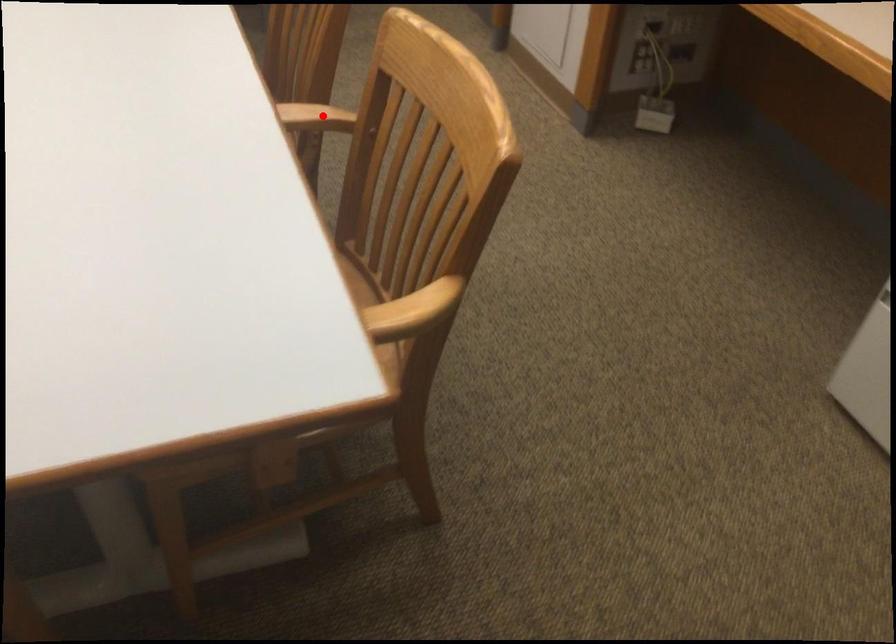
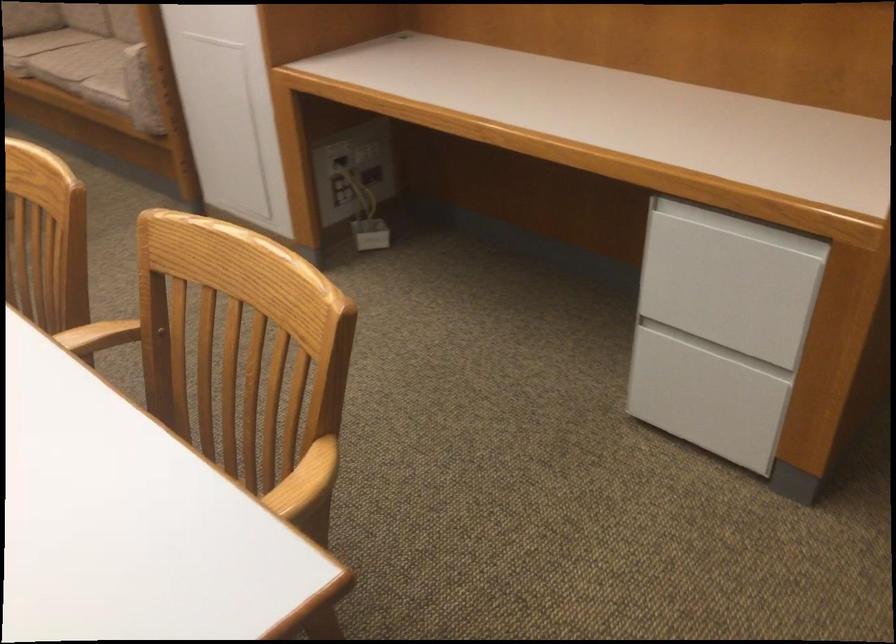
Locate, in the second image, the point that corresponds to the highlighted location in the first image.

(104, 335)